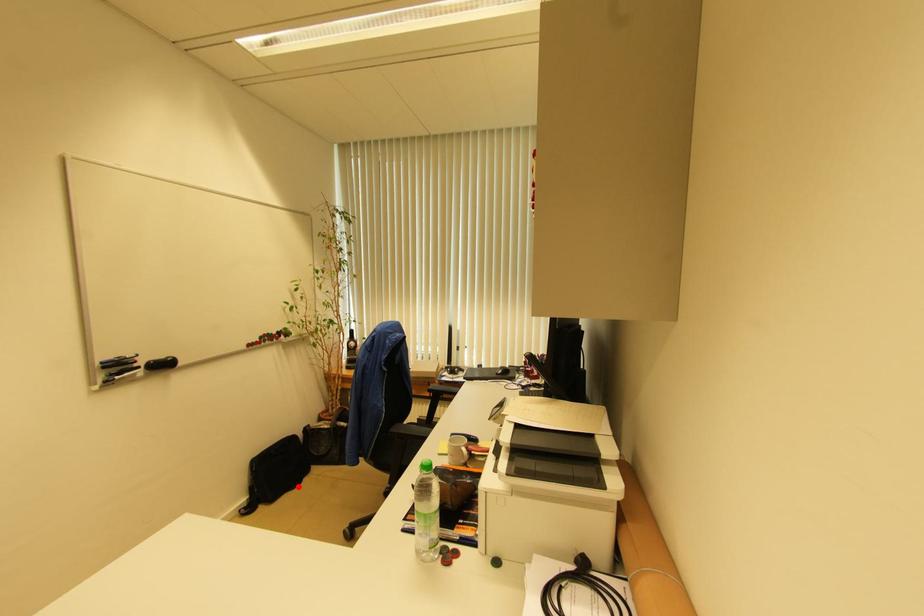
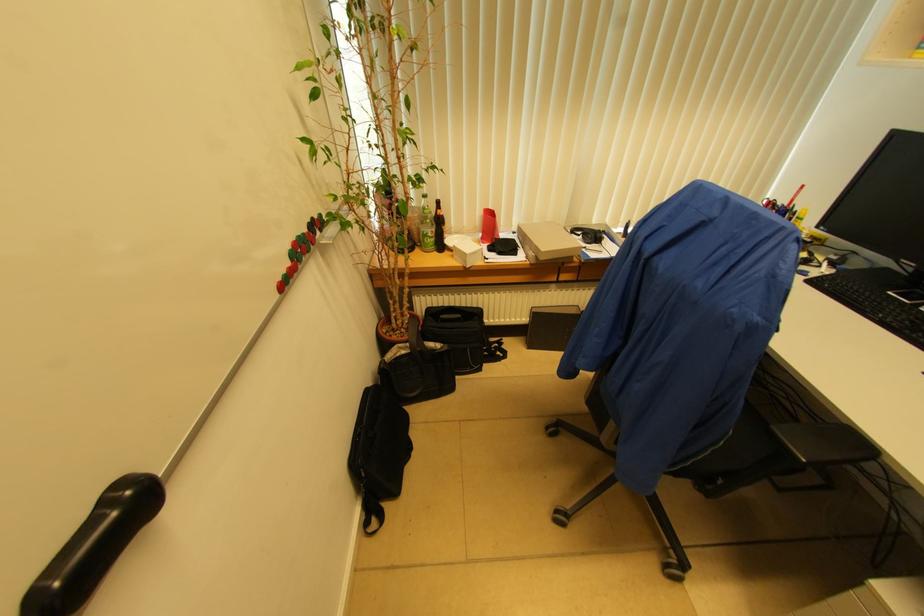
Find the pixel in the second image that matches the highlighted location in the first image.

(409, 451)